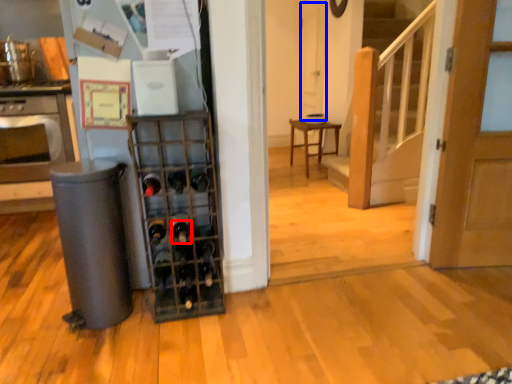
Question: Which object is closer to the camera taking this photo, wine bottle (highlighted by a red box) or screen door (highlighted by a blue box)?

Choices:
 (A) wine bottle
 (B) screen door

Answer: (A)